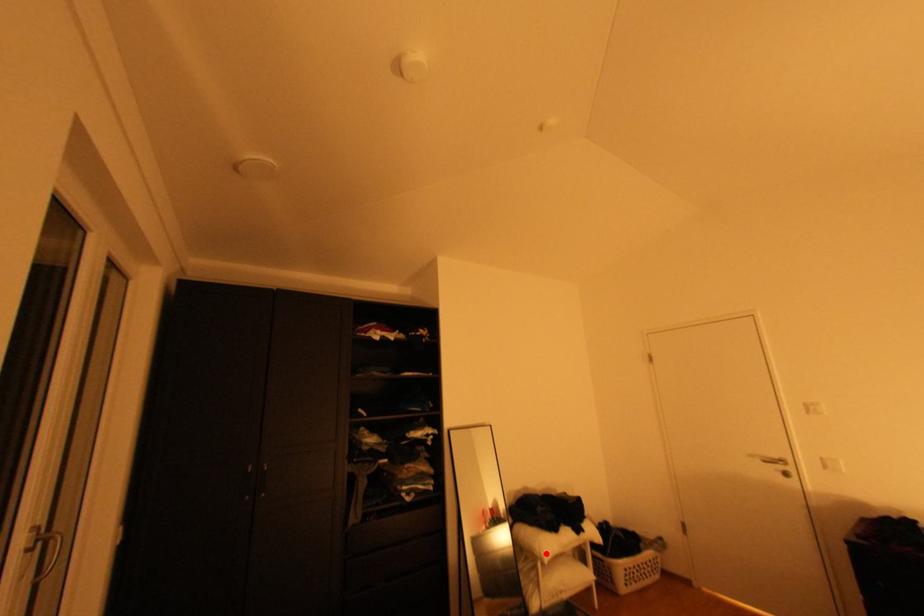
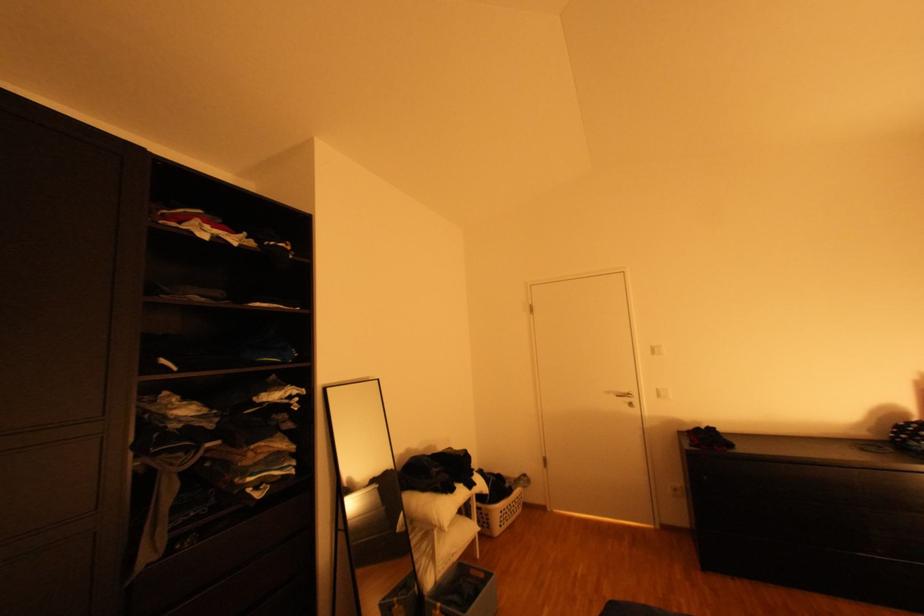
Question: I am providing you with two images of the same scene from different viewpoints. Image1 has a red point marked. In image2, the corresponding 3D location appears at what relative position? Reply with the corresponding letter.

Choices:
 (A) Closer
 (B) Farther

Answer: (B)